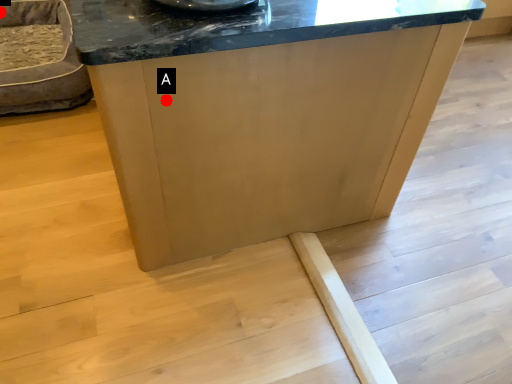
Question: Two points are circled on the image, labeled by A and B beside each circle. Which of the following is the closest to the observer?

Choices:
 (A) A is closer
 (B) B is closer

Answer: (A)